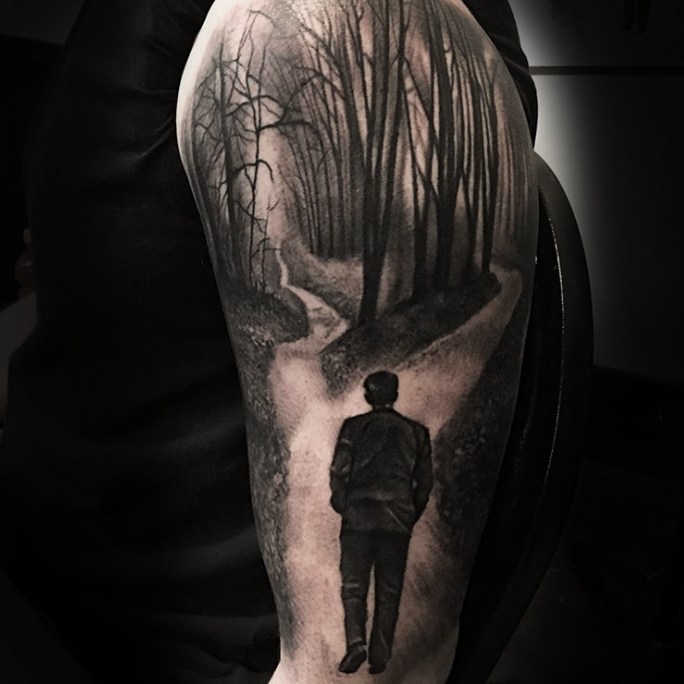
You are a GUI agent. You are given a task and a screenshot of the screen. Output one action in this format:
    pyautogui.click(x=<x>, y=<y>)
    Task: Click on the chair
    The height and width of the screenshot is (684, 684).
    Given the screenshot: What is the action you would take?
    pyautogui.click(x=562, y=319)